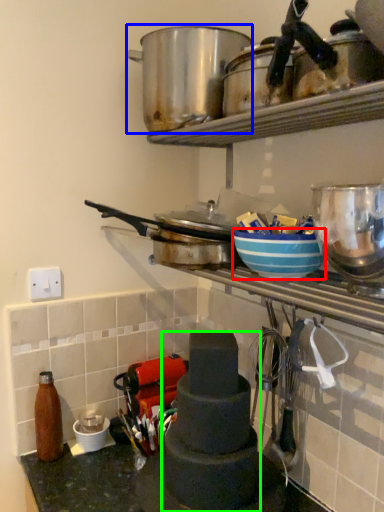
Question: Estimate the real-world distances between objects in this image. Which object is closer to bowl (highlighted by a red box), crock pot (highlighted by a blue box) or appliance (highlighted by a green box)?

Choices:
 (A) crock pot
 (B) appliance

Answer: (B)